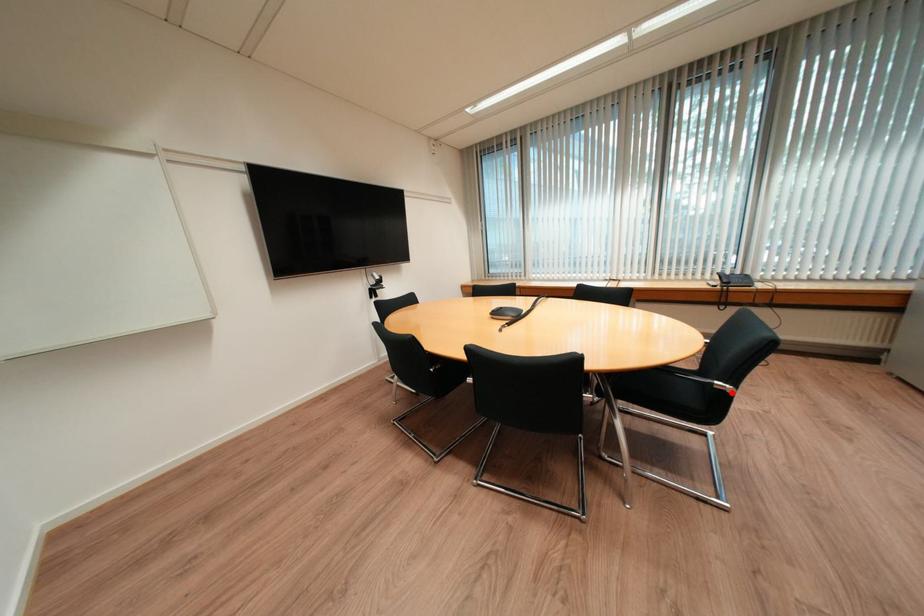
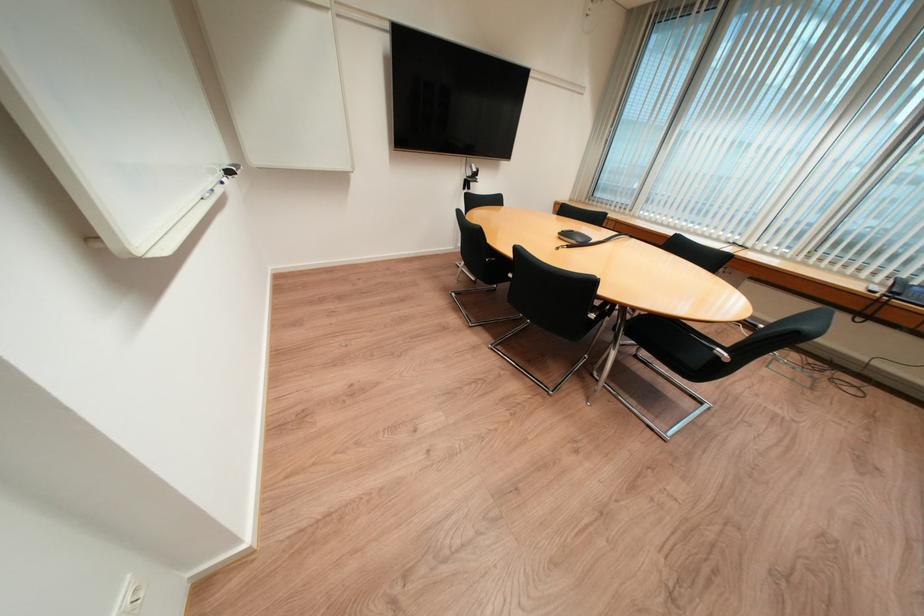
Where in the second image is the point corresponding to the highlighted location from the first image?

(725, 359)